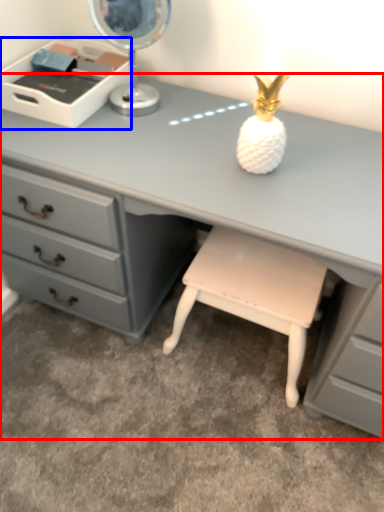
Question: Which point is closer to the camera, desk (highlighted by a red box) or writing desk (highlighted by a blue box)?

Choices:
 (A) desk
 (B) writing desk

Answer: (A)